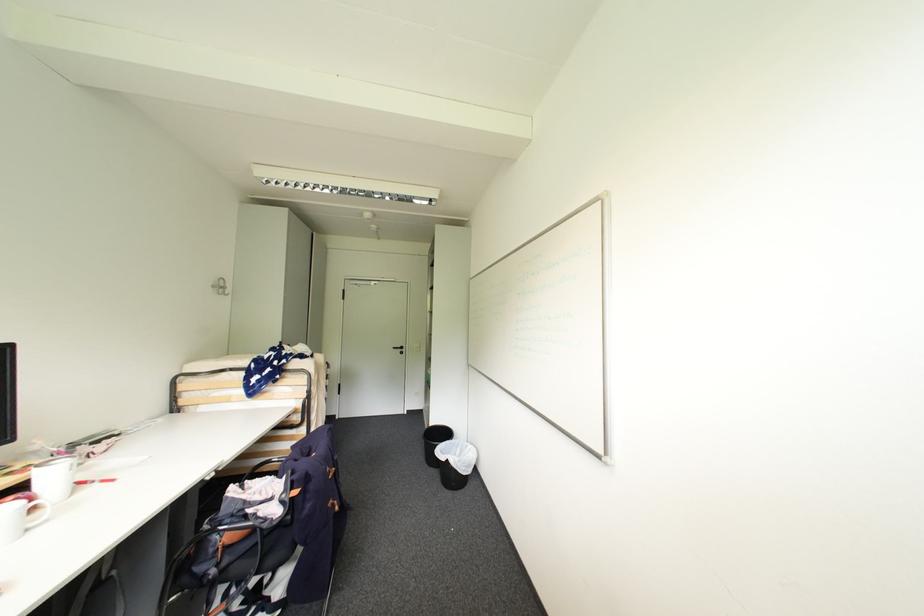
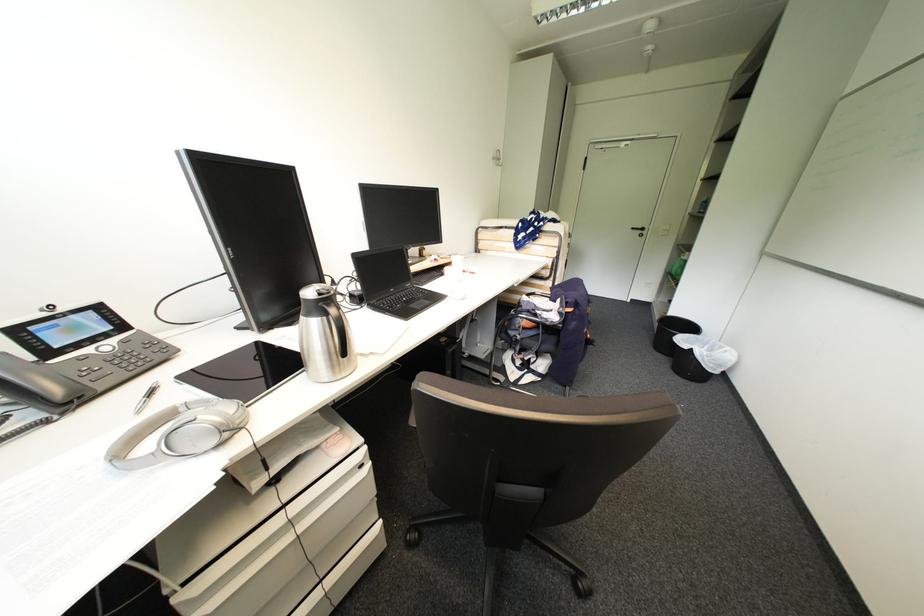
Where in the second image is the point corresponding to point (407, 351) from the first image?

(648, 233)